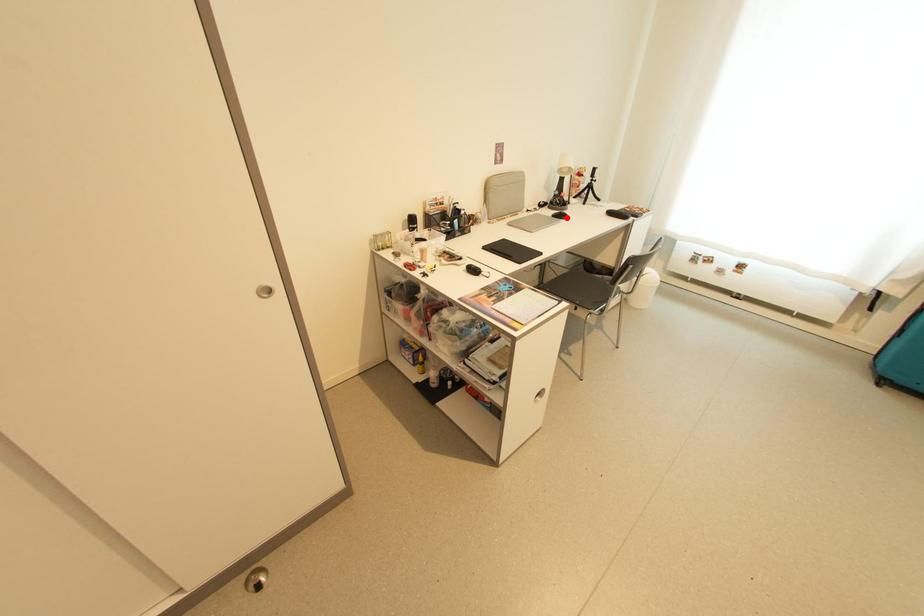
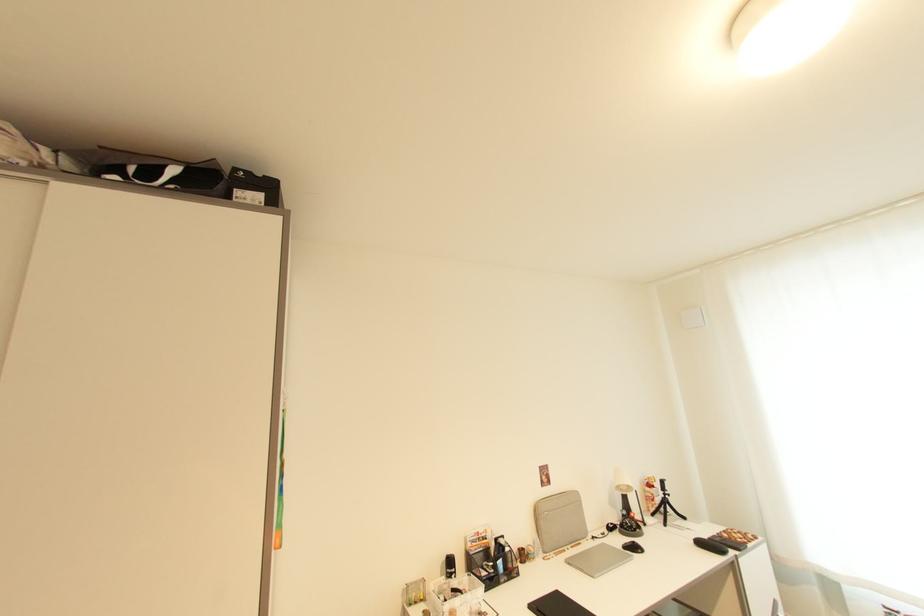
The point at the highlighted location is marked in the first image. Where is the corresponding point in the second image?

(639, 549)